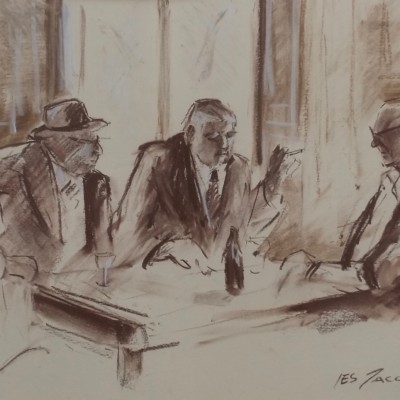
Where is `window`? This screenshot has height=400, width=400. window is located at coordinates (215, 32).